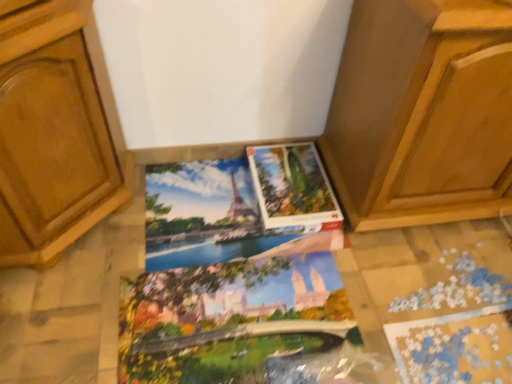
Question: Is matte paper coloring book at center, marked as the first coloring book in a bottom-to-top arrangement, shorter than matte cardboard puzzle at center?

Choices:
 (A) yes
 (B) no

Answer: (A)

Question: Is matte paper coloring book at center, positioned as the 2th coloring book in top-to-bottom order, facing away from matte cardboard puzzle at center?

Choices:
 (A) yes
 (B) no

Answer: (B)

Question: Does matte paper coloring book at center, positioned as the 2th coloring book in top-to-bottom order, have a greater width compared to matte cardboard puzzle at center?

Choices:
 (A) no
 (B) yes

Answer: (B)

Question: Is matte paper coloring book at center, marked as the first coloring book in a bottom-to-top arrangement, at the left side of matte cardboard puzzle at center?

Choices:
 (A) yes
 (B) no

Answer: (A)

Question: Does matte paper coloring book at center, positioned as the 2th coloring book in top-to-bottom order, appear on the right side of matte cardboard puzzle at center?

Choices:
 (A) yes
 (B) no

Answer: (B)

Question: Considering the relative positions of wooden cabinet at center and matte paper coloring book at center, placed as the first coloring book when sorted from top to bottom, in the image provided, is wooden cabinet at center to the left or to the right of matte paper coloring book at center, placed as the first coloring book when sorted from top to bottom,?

Choices:
 (A) left
 (B) right

Answer: (B)

Question: Is wooden cabinet at center wider or thinner than matte paper coloring book at center, placed as the first coloring book when sorted from top to bottom?

Choices:
 (A) thin
 (B) wide

Answer: (B)

Question: Is wooden cabinet at center in front of or behind matte paper coloring book at center, placed as the 2th coloring book when sorted from bottom to top, in the image?

Choices:
 (A) front
 (B) behind

Answer: (A)

Question: Based on their sizes in the image, would you say wooden cabinet at center is bigger or smaller than matte paper coloring book at center, placed as the first coloring book when sorted from top to bottom?

Choices:
 (A) big
 (B) small

Answer: (A)

Question: Looking at their shapes, would you say matte paper coloring book at center, marked as the first coloring book in a bottom-to-top arrangement, is wider or thinner than matte paper coloring book at center, placed as the 2th coloring book when sorted from bottom to top?

Choices:
 (A) thin
 (B) wide

Answer: (B)

Question: Is matte paper coloring book at center, marked as the first coloring book in a bottom-to-top arrangement, bigger or smaller than matte paper coloring book at center, placed as the 2th coloring book when sorted from bottom to top?

Choices:
 (A) small
 (B) big

Answer: (B)

Question: Visually, is matte paper coloring book at center, marked as the first coloring book in a bottom-to-top arrangement, positioned to the left or to the right of matte paper coloring book at center, placed as the first coloring book when sorted from top to bottom?

Choices:
 (A) right
 (B) left

Answer: (A)

Question: From their relative heights in the image, would you say matte paper coloring book at center, marked as the first coloring book in a bottom-to-top arrangement, is taller or shorter than matte paper coloring book at center, placed as the first coloring book when sorted from top to bottom?

Choices:
 (A) tall
 (B) short

Answer: (B)

Question: Is matte paper coloring book at center, positioned as the 2th coloring book in top-to-bottom order, to the left or to the right of matte cardboard puzzle at center in the image?

Choices:
 (A) left
 (B) right

Answer: (A)

Question: Is matte paper coloring book at center, positioned as the 2th coloring book in top-to-bottom order, taller or shorter than matte cardboard puzzle at center?

Choices:
 (A) tall
 (B) short

Answer: (B)